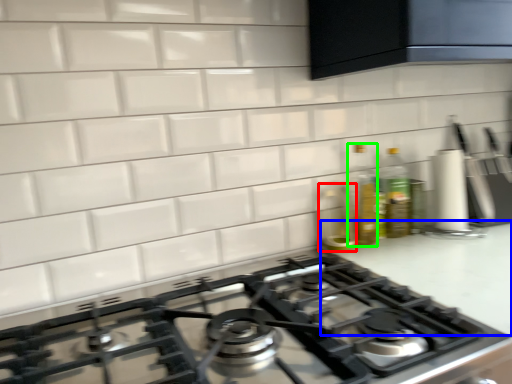
Question: Which is farther away from appliance (highlighted by a red box)? counter top (highlighted by a blue box) or bottle (highlighted by a green box)?

Choices:
 (A) counter top
 (B) bottle

Answer: (A)